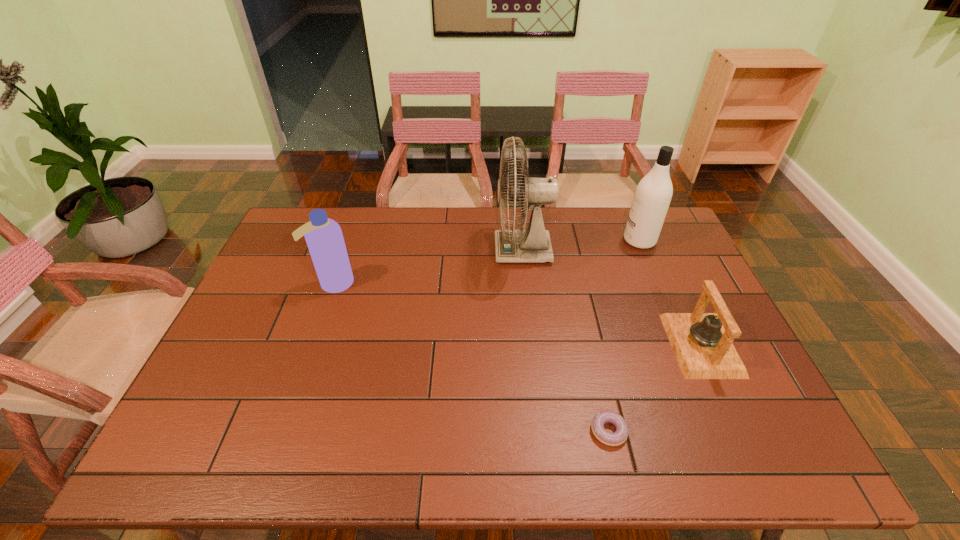
Identify the location of vacant area that satisfies the following two spatial constraints: 1. on the front side of the nearer shampoo; 2. on the left side of the third object from left to right. (282, 431).

Where is `vacant area that satisfies the following two spatial constraints: 1. on the front-facing side of the farther shampoo; 2. on the left side of the second nearest object`? The image size is (960, 540). vacant area that satisfies the following two spatial constraints: 1. on the front-facing side of the farther shampoo; 2. on the left side of the second nearest object is located at coordinates (684, 345).

The width and height of the screenshot is (960, 540). In order to click on vacant space that satisfies the following two spatial constraints: 1. on the front side of the left shampoo; 2. on the right side of the second nearest object in this screenshot , I will do `click(312, 345)`.

Where is `vacant space that satisfies the following two spatial constraints: 1. on the front-facing side of the fan; 2. on the back side of the nearest object`? The height and width of the screenshot is (540, 960). vacant space that satisfies the following two spatial constraints: 1. on the front-facing side of the fan; 2. on the back side of the nearest object is located at coordinates (542, 431).

This screenshot has height=540, width=960. Identify the location of free space that satisfies the following two spatial constraints: 1. on the front-facing side of the right shampoo; 2. on the front side of the leftmost object. (658, 284).

Locate an element on the screen. The height and width of the screenshot is (540, 960). free space that satisfies the following two spatial constraints: 1. on the front-facing side of the taller shampoo; 2. on the left side of the second nearest object is located at coordinates (684, 345).